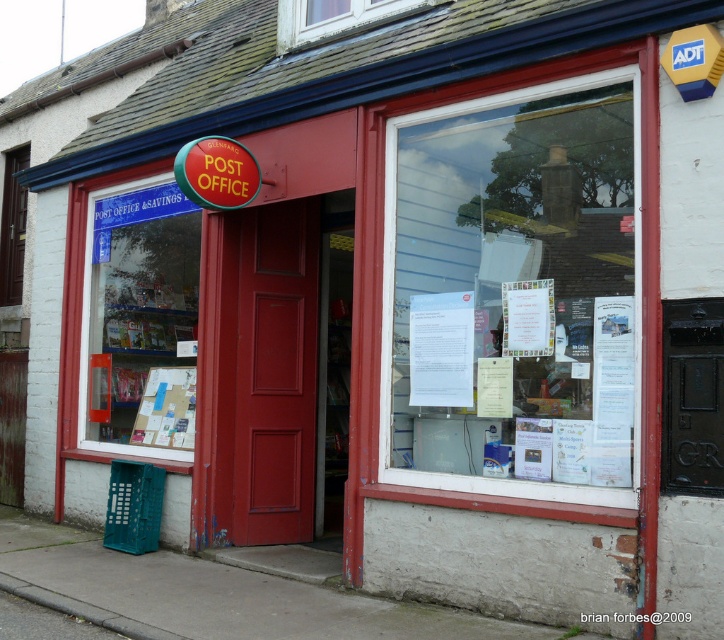
Question: Among these points, which one is nearest to the camera?

Choices:
 (A) (369, 10)
 (B) (16, 225)

Answer: (A)

Question: Is gray concrete pavement at lower center closer to camera compared to orange plastic sign at upper center?

Choices:
 (A) yes
 (B) no

Answer: (A)

Question: Can you confirm if clear glass window at upper center is positioned above cardboard bulletin board at center?

Choices:
 (A) no
 (B) yes

Answer: (B)

Question: Which of these objects is positioned farthest from the transparent glass window at center?

Choices:
 (A) gray concrete pavement at lower center
 (B) cardboard bulletin board at center

Answer: (B)

Question: Can you confirm if transparent glass window at center is smaller than transparent glass window at left?

Choices:
 (A) yes
 (B) no

Answer: (B)

Question: Which object appears farthest from the camera in this image?

Choices:
 (A) orange plastic sign at upper center
 (B) transparent glass window at left
 (C) cardboard bulletin board at center
 (D) transparent glass window at center

Answer: (B)